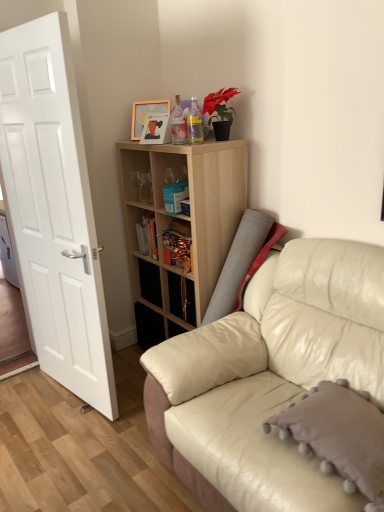
Identify the location of free point above gray fluffy pillow at lower right (from a real-world perspective). (341, 410).